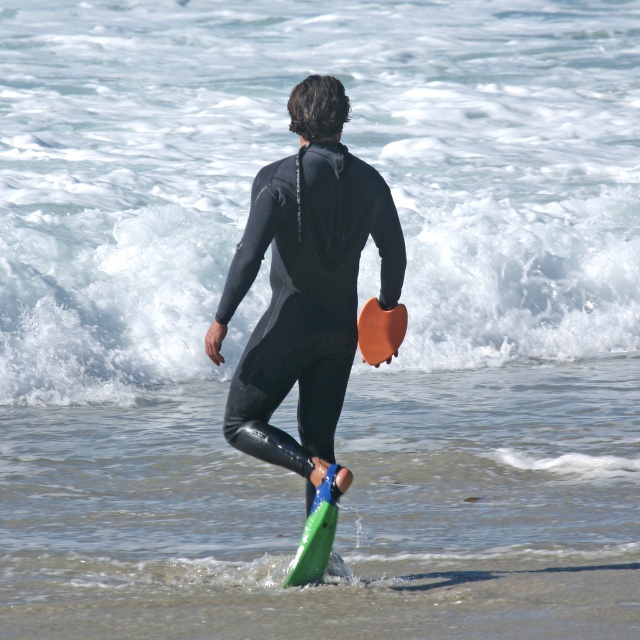
You are a photographer trying to capture the person entering the ocean. You need to ensure the white frothy wave at upper center and the green rubber surfboard at lower center are both visible in the frame. Which object should you focus on first to include both in your shot?

The white frothy wave at upper center is not as tall as the green rubber surfboard at lower center, so you should focus on the taller green rubber surfboard at lower center first to ensure both objects are in the frame.

From the picture: You are a lifeguard observing the scene from a tower. You notice a green rubber surfboard at lower center. Where exactly is the green rubber surfboard positioned in the image?

The green rubber surfboard at lower center is located at point (x=316, y=532).

You are the person in the image preparing to enter the ocean. You notice a white frothy wave at upper center. Based on its position, should you move towards the left or right to avoid it?

The white frothy wave at upper center is located at point (113,285), so you should move to the right to avoid it.